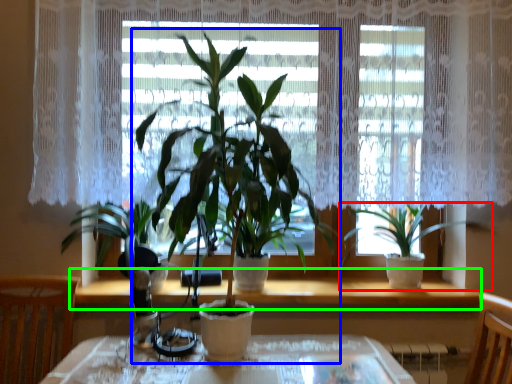
Question: Based on their relative distances, which object is nearer to houseplant (highlighted by a red box)? Choose from houseplant (highlighted by a blue box) and window sill (highlighted by a green box).

Choices:
 (A) houseplant
 (B) window sill

Answer: (B)